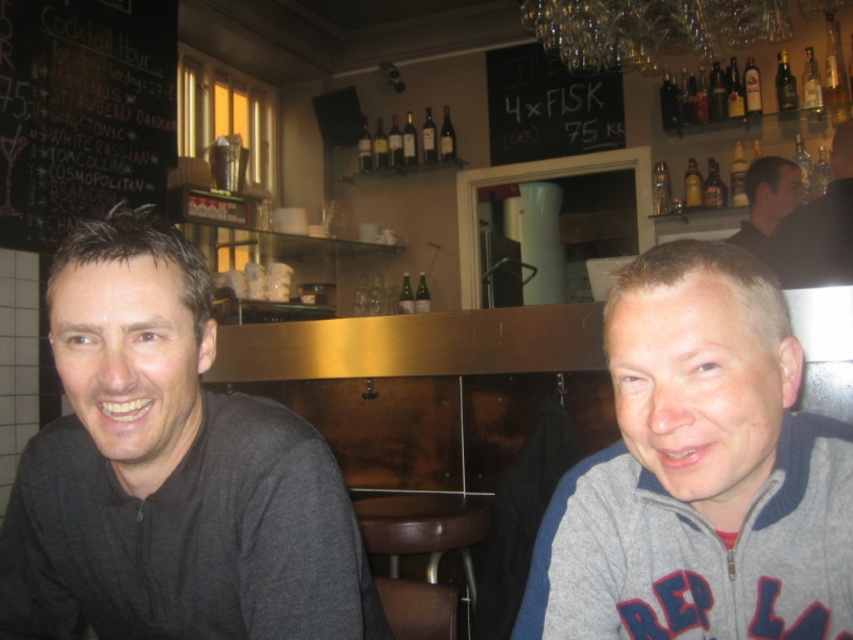
Who is shorter, gray fleece jacket at lower right or brown leather stool at center?

With less height is gray fleece jacket at lower right.

Which is in front, point (555, 566) or point (451, 632)?

Point (555, 566) is in front.

Who is more distant from viewer, (727, 296) or (479, 513)?

The point (479, 513) is more distant.

Find the location of a particular element. gray fleece jacket at lower right is located at coordinates (699, 472).

This screenshot has height=640, width=853. Describe the element at coordinates (169, 472) in the screenshot. I see `gray zip-up jacket at left` at that location.

Who is positioned more to the left, gray zip-up jacket at left or brown leather stool at center?

From the viewer's perspective, gray zip-up jacket at left appears more on the left side.

Between point (171, 557) and point (399, 625), which one is positioned behind?

The point (399, 625) is behind.

Identify the location of gray zip-up jacket at left. (169, 472).

Between point (120, 449) and point (822, 195), which one is positioned behind?

The point (822, 195) is more distant.

Is gray zip-up jacket at left bigger than black leather jacket at upper right?

No.

Is point (64, 568) farther from viewer compared to point (850, 252)?

That is False.

Image resolution: width=853 pixels, height=640 pixels. Find the location of `gray zip-up jacket at left`. gray zip-up jacket at left is located at coordinates (169, 472).